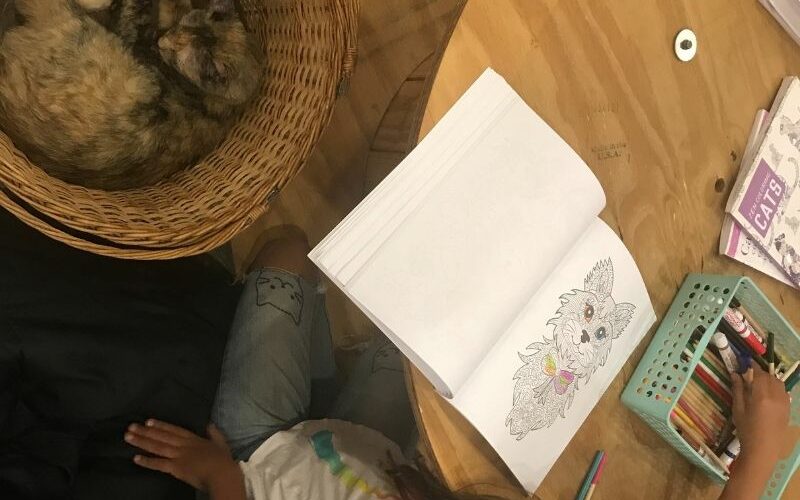
Identify the location of large wicker basket. (190, 217).